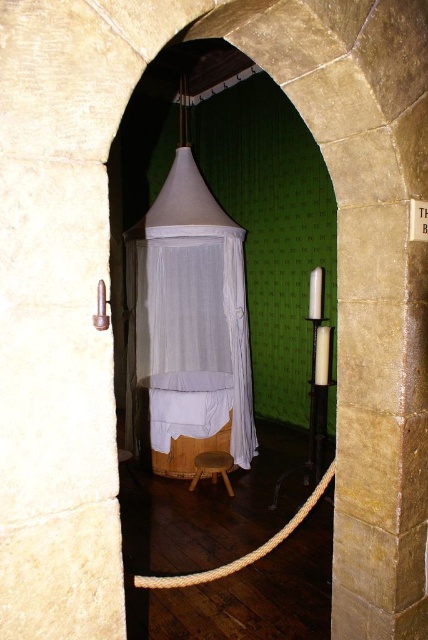
You are a medieval knight standing in the doorway and want to enter the room to sit on the stool. The knight is 1.8 meters tall. Is there enough vertical space between the white fabric canopy bed at center and the white rope at center for the knight to pass through without touching anything?

The vertical space between the white fabric canopy bed at center and the white rope at center is 2.75 meters. Since the knight is only 1.8 meters tall, there is sufficient clearance for them to pass through without touching either the canopy bed or the ropes.

Looking at this image, you are an interior designer planning to hang a heavy chandelier in the medieval room. You notice the white rope at center and the light brown wooden stool at center. Which object would be more suitable to support the chandelier based on their sizes?

The white rope at center is bigger than the light brown wooden stool at center, so the white rope at center would be more suitable to support the chandelier as it has a larger size, which might indicate greater strength or capacity.